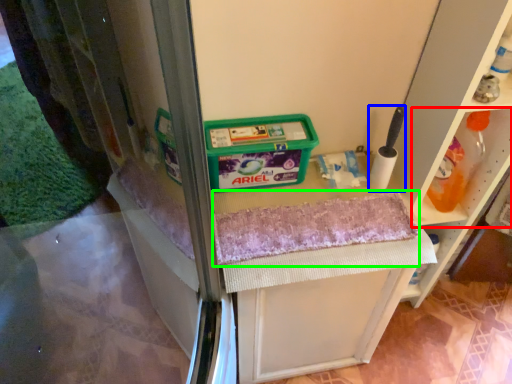
Question: Which object is positioned closest to shelf (highlighted by a red box)? Select from brush (highlighted by a blue box) and bath towel (highlighted by a green box).

Choices:
 (A) brush
 (B) bath towel

Answer: (A)